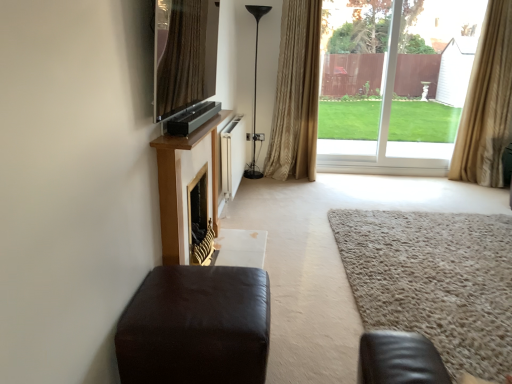
Question: In which direction should I rotate to look at gold textured curtain at center, arranged as the 2th curtain when viewed from the right?

Choices:
 (A) right
 (B) left

Answer: (A)

Question: From a real-world perspective, is black matte floor lamp at center positioned under gold textured curtain at center, which is the 1th curtain from left to right, based on gravity?

Choices:
 (A) no
 (B) yes

Answer: (B)

Question: Can you confirm if black matte floor lamp at center is wider than gold textured curtain at center, which is the 1th curtain from left to right?

Choices:
 (A) no
 (B) yes

Answer: (B)

Question: From the image's perspective, is black matte floor lamp at center located beneath gold textured curtain at center, which is the 1th curtain from left to right?

Choices:
 (A) yes
 (B) no

Answer: (A)

Question: Considering the relative sizes of black matte floor lamp at center and gold textured curtain at center, arranged as the 2th curtain when viewed from the right, in the image provided, is black matte floor lamp at center taller than gold textured curtain at center, arranged as the 2th curtain when viewed from the right,?

Choices:
 (A) no
 (B) yes

Answer: (A)

Question: Is black matte floor lamp at center positioned behind gold textured curtain at center, arranged as the 2th curtain when viewed from the right?

Choices:
 (A) yes
 (B) no

Answer: (A)

Question: Does black matte floor lamp at center have a larger size compared to gold textured curtain at center, which is the 1th curtain from left to right?

Choices:
 (A) no
 (B) yes

Answer: (A)

Question: Considering the relative sizes of beige fabric curtain at right, acting as the 2th curtain starting from the left, and matte black ottoman at lower left in the image provided, is beige fabric curtain at right, acting as the 2th curtain starting from the left, shorter than matte black ottoman at lower left?

Choices:
 (A) no
 (B) yes

Answer: (A)

Question: Is beige fabric curtain at right, the 1th curtain positioned from the right, not within matte black ottoman at lower left?

Choices:
 (A) no
 (B) yes

Answer: (B)

Question: Is beige fabric curtain at right, acting as the 2th curtain starting from the left, looking in the opposite direction of matte black ottoman at lower left?

Choices:
 (A) no
 (B) yes

Answer: (A)

Question: Is beige fabric curtain at right, acting as the 2th curtain starting from the left, thinner than matte black ottoman at lower left?

Choices:
 (A) no
 (B) yes

Answer: (B)

Question: Can you confirm if beige fabric curtain at right, acting as the 2th curtain starting from the left, is bigger than matte black ottoman at lower left?

Choices:
 (A) no
 (B) yes

Answer: (B)

Question: Can you confirm if beige fabric curtain at right, the 1th curtain positioned from the right, is positioned to the right of matte black ottoman at lower left?

Choices:
 (A) yes
 (B) no

Answer: (A)

Question: From the image's perspective, is beige fabric curtain at right, acting as the 2th curtain starting from the left, above matte black tv at upper center?

Choices:
 (A) no
 (B) yes

Answer: (B)